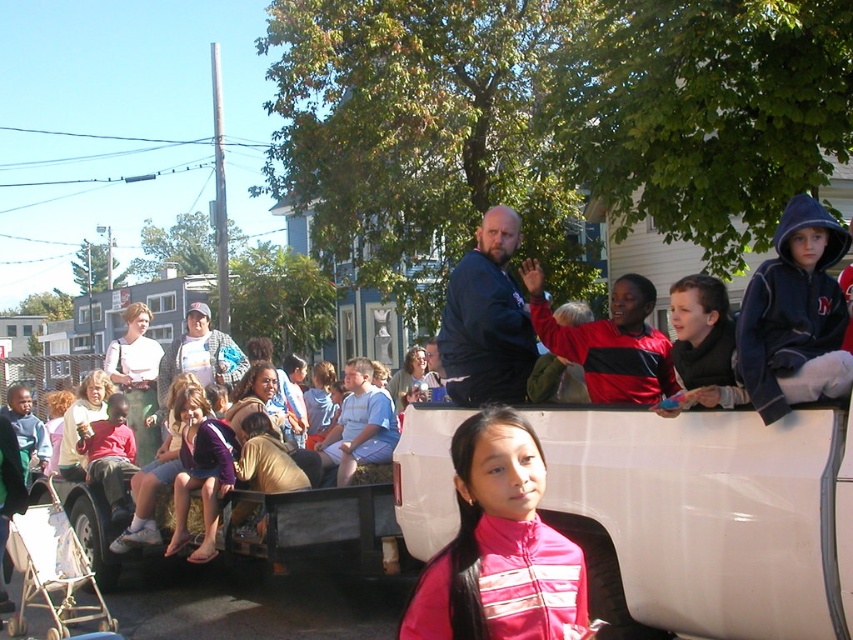
Question: Does pink fabric jacket at center have a smaller size compared to dark blue hoodie at right?

Choices:
 (A) yes
 (B) no

Answer: (A)

Question: Which of the following is the farthest from the observer?

Choices:
 (A) pink fabric jacket at center
 (B) matte black jacket at upper right

Answer: (B)

Question: Which of the following is the closest to the observer?

Choices:
 (A) matte black jacket at upper right
 (B) dark blue hoodie at right

Answer: (B)

Question: Can you confirm if matte blue shirt at center is smaller than dark blue hoodie at right?

Choices:
 (A) yes
 (B) no

Answer: (B)

Question: Is red and black jacket at upper right to the right of matte black jacket at upper right from the viewer's perspective?

Choices:
 (A) no
 (B) yes

Answer: (A)

Question: Among these points, which one is farthest from the camera?

Choices:
 (A) (444, 636)
 (B) (677, 298)

Answer: (B)